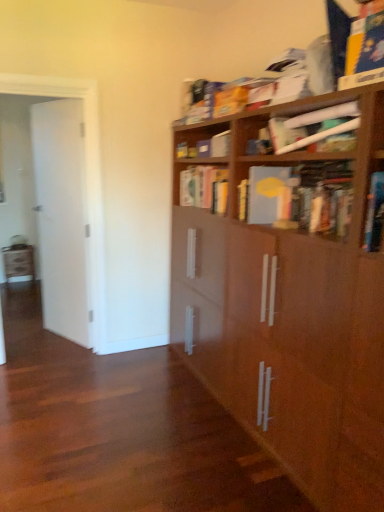
Question: From the image's perspective, is matte gray book at upper right, arranged as the 2th book when viewed from the back, above or below white glossy door at left?

Choices:
 (A) below
 (B) above

Answer: (B)

Question: Would you say matte gray book at upper right, arranged as the 2th book when viewed from the back, is to the left or to the right of white glossy door at left in the picture?

Choices:
 (A) right
 (B) left

Answer: (A)

Question: Which is farther from the brown wood bookcase at upper right?

Choices:
 (A) matte gray book at upper right, acting as the second book starting from the front
 (B) white glossy door at left
 (C) matte white paper at upper right, arranged as the third book when viewed from the back
 (D) yellow matte book at center, which is counted as the 3th book, starting from the front

Answer: (B)

Question: Which is nearer to the matte white paper at upper right, positioned as the 1th book in front-to-back order?

Choices:
 (A) brown wood bookcase at upper right
 (B) matte gray book at upper right, arranged as the 2th book when viewed from the back
 (C) white glossy door at left
 (D) yellow matte book at center, the first book in the back-to-front sequence

Answer: (B)